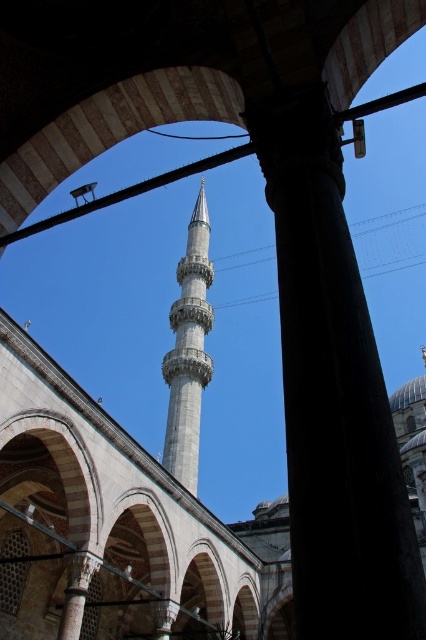
From the picture: Is smooth stone pillar at center smaller than smooth white minaret at center?

Correct, smooth stone pillar at center occupies less space than smooth white minaret at center.

Is smooth stone pillar at center bigger than smooth white minaret at center?

No.

Which is behind, point (359, 438) or point (181, 288)?

Point (181, 288)

At what (x,y) coordinates should I click in order to perform the action: click on smooth stone pillar at center. Please return your answer as a coordinate pair (x, y). The height and width of the screenshot is (640, 426). Looking at the image, I should click on (333, 394).